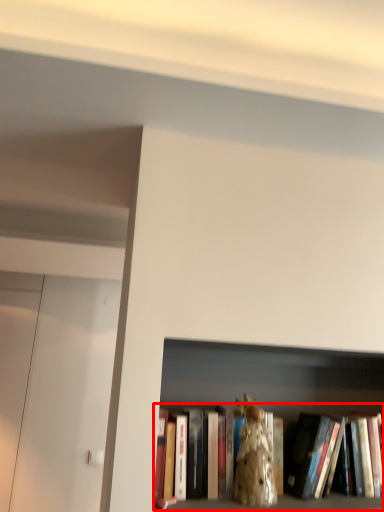
Question: From the image's perspective, where is book (annotated by the red box) located in relation to animal in the image?

Choices:
 (A) below
 (B) above

Answer: (A)